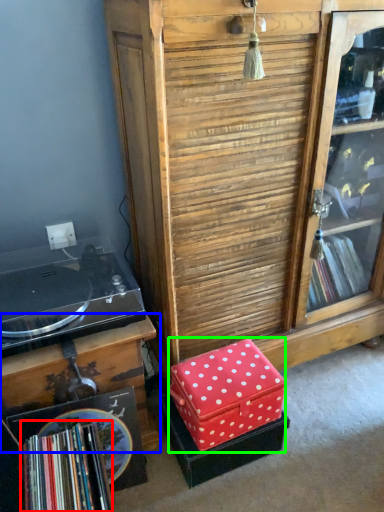
Question: Estimate the real-world distances between objects in this image. Which object is farther from book (highlighted by a red box), table (highlighted by a blue box) or storage box (highlighted by a green box)?

Choices:
 (A) table
 (B) storage box

Answer: (B)